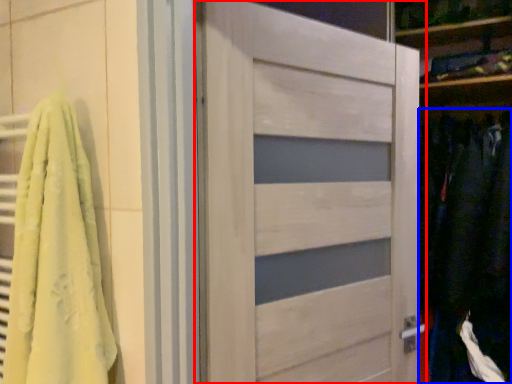
Question: Which object is further to the camera taking this photo, door (highlighted by a red box) or clothing (highlighted by a blue box)?

Choices:
 (A) door
 (B) clothing

Answer: (B)